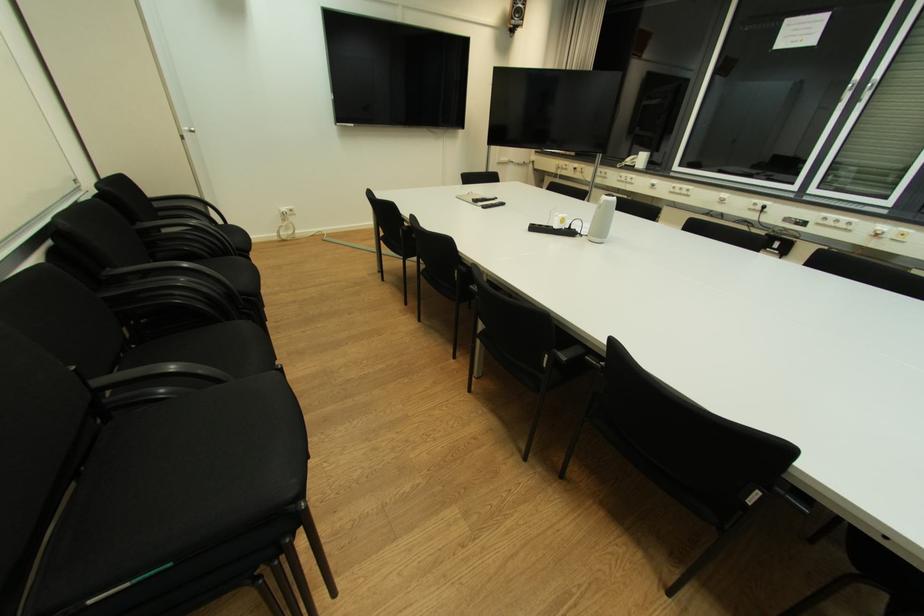
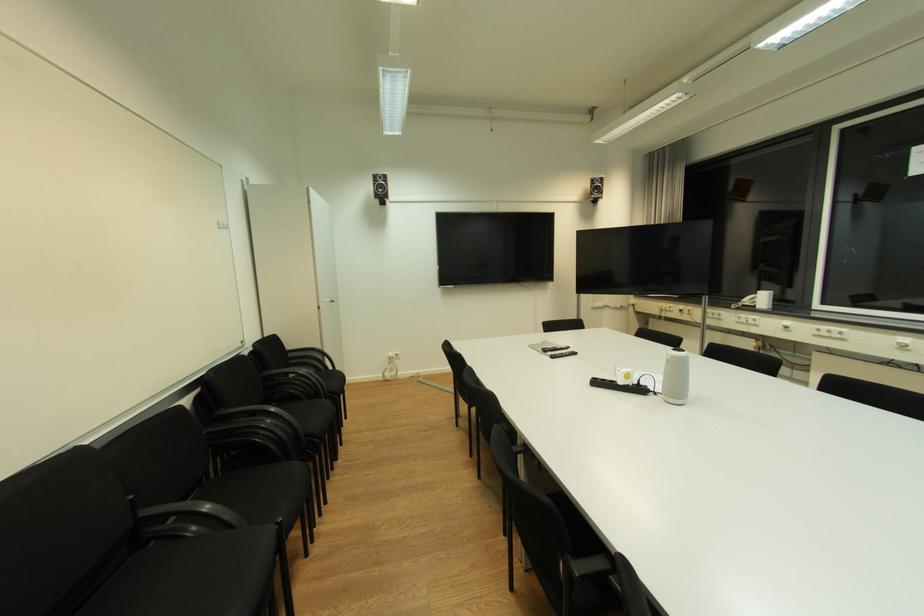
First-person continuous shooting, in which direction is the camera rotating?

The camera rotated toward left-up.